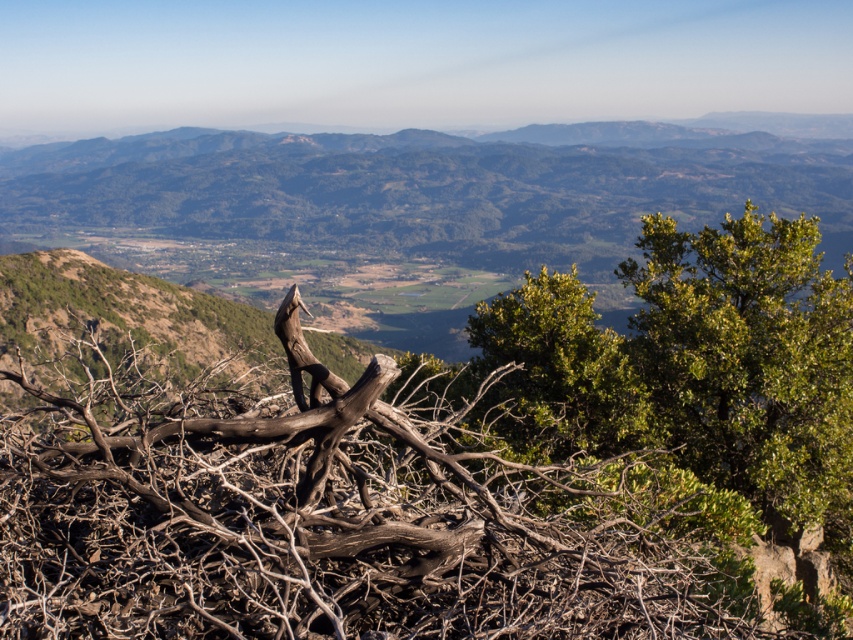
You are standing at the point marked as point (334, 512). Based on the scene description, what type of surface are you currently standing on?

The point (334, 512) is on brown dry wood at center, so you are standing on brown dry wood.